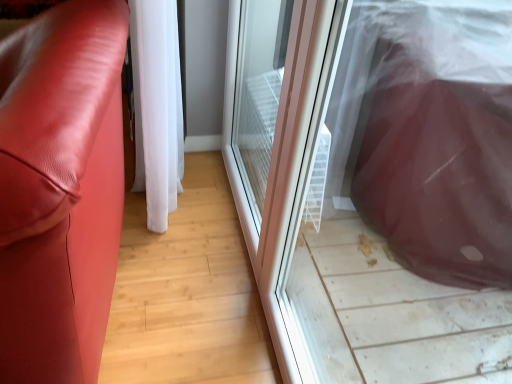
Question: Does matte leather couch at left appear on the right side of transparent plastic screen door at center, arranged as the 2th screen door when viewed from the front?

Choices:
 (A) yes
 (B) no

Answer: (B)

Question: Is there a large distance between matte leather couch at left and transparent plastic screen door at center, the 1th screen door when ordered from back to front?

Choices:
 (A) yes
 (B) no

Answer: (B)

Question: Is transparent plastic screen door at center, the 1th screen door when ordered from back to front, at the back of matte leather couch at left?

Choices:
 (A) yes
 (B) no

Answer: (A)

Question: Is matte leather couch at left outside transparent plastic screen door at center, the 1th screen door when ordered from back to front?

Choices:
 (A) no
 (B) yes

Answer: (B)

Question: Is matte leather couch at left thinner than transparent plastic screen door at center, the 1th screen door when ordered from back to front?

Choices:
 (A) no
 (B) yes

Answer: (A)

Question: Considering the relative sizes of matte leather couch at left and transparent plastic screen door at center, arranged as the 2th screen door when viewed from the front, in the image provided, is matte leather couch at left wider than transparent plastic screen door at center, arranged as the 2th screen door when viewed from the front,?

Choices:
 (A) no
 (B) yes

Answer: (B)

Question: From a real-world perspective, is matte leather couch at left beneath white sheer curtain at center?

Choices:
 (A) yes
 (B) no

Answer: (B)

Question: Is matte leather couch at left in front of white sheer curtain at center?

Choices:
 (A) yes
 (B) no

Answer: (A)

Question: Does matte leather couch at left appear on the right side of white sheer curtain at center?

Choices:
 (A) yes
 (B) no

Answer: (B)

Question: Does matte leather couch at left have a greater height compared to white sheer curtain at center?

Choices:
 (A) no
 (B) yes

Answer: (A)

Question: Are matte leather couch at left and white sheer curtain at center located far from each other?

Choices:
 (A) no
 (B) yes

Answer: (A)

Question: From a real-world perspective, does matte leather couch at left stand above white sheer curtain at center?

Choices:
 (A) no
 (B) yes

Answer: (B)

Question: Is transparent plastic screen door at center, arranged as the 2th screen door when viewed from the front, located outside transparent plastic screen door at right, which is the second screen door in back-to-front order?

Choices:
 (A) no
 (B) yes

Answer: (B)